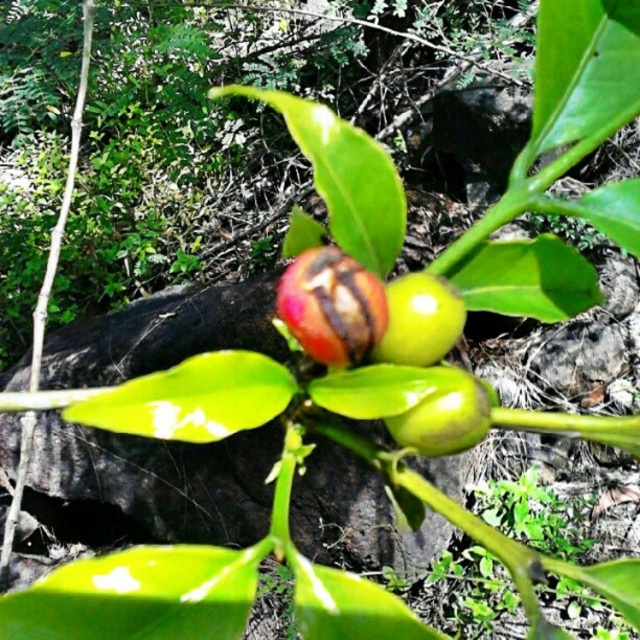
Who is more distant from viewer, [374,291] or [406,428]?

The point [406,428] is more distant.

Measure the distance between point (360, 285) and camera.

Point (360, 285) is 14.66 inches away from camera.

Does point (365, 300) lie behind point (477, 419)?

Yes, it is behind point (477, 419).

Find the location of a particular element. shiny red fruit at center is located at coordinates (332, 307).

Between point (324, 355) and point (445, 304), which one is positioned behind?

The point (445, 304) is more distant.

Is shiny red fruit at center to the right of green matte fruit at center from the viewer's perspective?

A: No, shiny red fruit at center is not to the right of green matte fruit at center.

You are a GUI agent. You are given a task and a screenshot of the screen. Output one action in this format:
    pyautogui.click(x=<x>, y=<y>)
    Task: Click on the shiny red fruit at center
    Image resolution: width=640 pixels, height=640 pixels.
    Given the screenshot: What is the action you would take?
    pyautogui.click(x=332, y=307)

This screenshot has height=640, width=640. I want to click on shiny red fruit at center, so (x=332, y=307).

Who is higher up, green matte fruit at center or green glossy fruit at center?

green matte fruit at center

Locate an element on the screen. The image size is (640, 640). green matte fruit at center is located at coordinates click(419, 321).

In order to click on green matte fruit at center in this screenshot , I will do `click(419, 321)`.